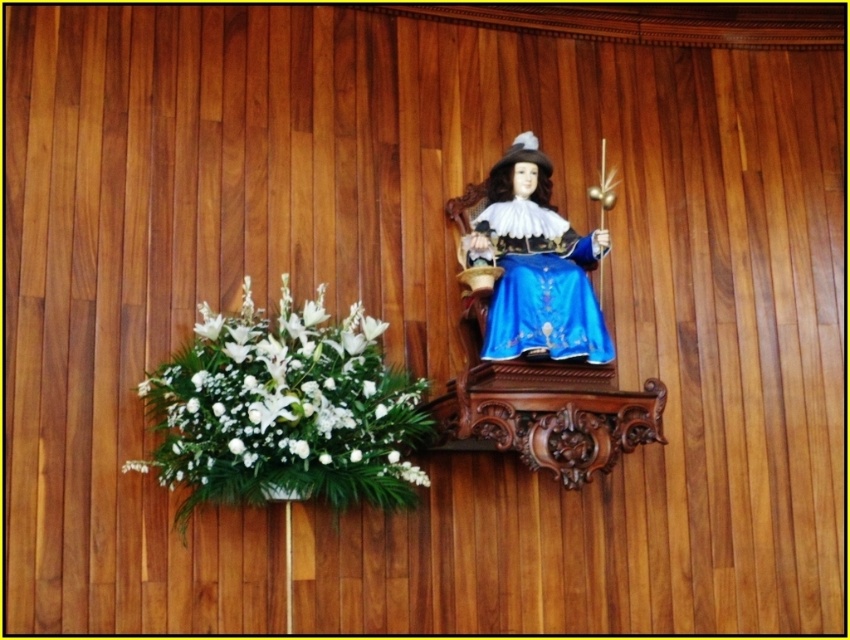
Is point (259, 360) closer to viewer compared to point (554, 344)?

Yes, it is.

Between white matte floral arrangement at lower left and blue satin dress at center, which one is positioned lower?

white matte floral arrangement at lower left is lower down.

Does point (196, 326) lie behind point (496, 346)?

No, (196, 326) is closer to viewer.

Identify the location of white matte floral arrangement at lower left. (284, 410).